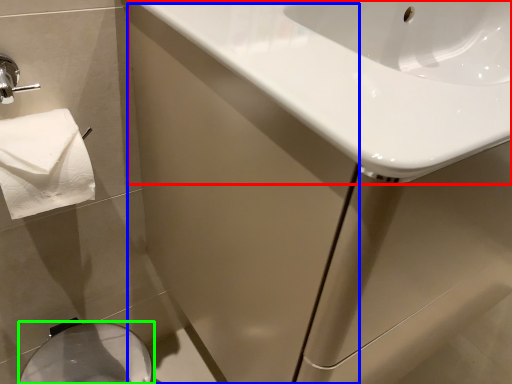
Question: Estimate the real-world distances between objects in this image. Which object is closer to sink (highlighted by a red box), screen door (highlighted by a blue box) or bidet (highlighted by a green box)?

Choices:
 (A) screen door
 (B) bidet

Answer: (A)